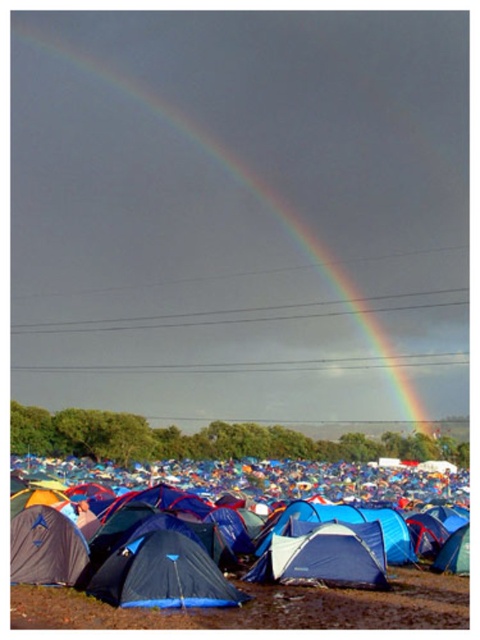
You are a photographer standing at the edge of the muddy field. You want to take a photo that includes both the rainbow at upper center and the blue fabric tent at lower center. Which object will appear closer to the camera in your photo?

The rainbow at upper center will appear closer to the camera because it is further to the viewer than the blue fabric tent at lower center, meaning it is positioned nearer in the visual plane.

You are a photographer planning to take a photo of the rainbow at upper center and the blue fabric tent at lower center. Based on their sizes in the image, which one would appear taller in the photo?

The rainbow at upper center appears taller than the blue fabric tent at lower center in the photo because the rainbow at upper center has a greater height compared to blue fabric tent at lower center.